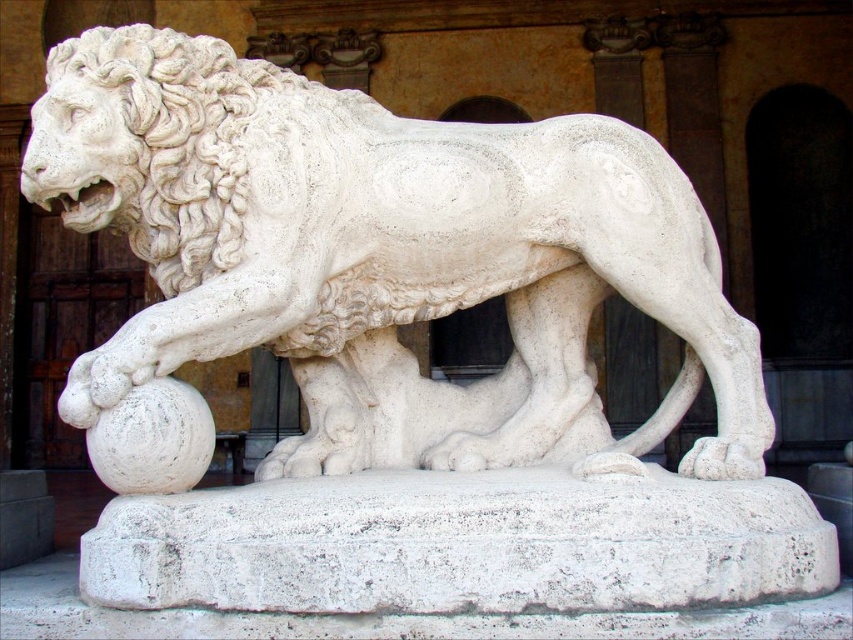
Between white stone paw at lower center and white marble paw at lower center, which one appears on the right side from the viewer's perspective?

From the viewer's perspective, white stone paw at lower center appears more on the right side.

Which is behind, point (720, 467) or point (612, 481)?

Positioned behind is point (720, 467).

The image size is (853, 640). I want to click on white stone paw at lower center, so click(724, 458).

What do you see at coordinates (376, 252) in the screenshot? I see `white marble lion at center` at bounding box center [376, 252].

This screenshot has width=853, height=640. What do you see at coordinates (376, 252) in the screenshot?
I see `white marble lion at center` at bounding box center [376, 252].

Identify the location of white marble lion at center. The width and height of the screenshot is (853, 640). (376, 252).

Find the location of a particular element. The image size is (853, 640). white marble lion at center is located at coordinates (376, 252).

Can you confirm if white marble lion at center is shorter than white stone paw at lower center?

In fact, white marble lion at center may be taller than white stone paw at lower center.

Who is more forward, (273, 193) or (759, 461)?

Point (273, 193) is in front.

What are the coordinates of `white marble lion at center` in the screenshot? It's located at (376, 252).